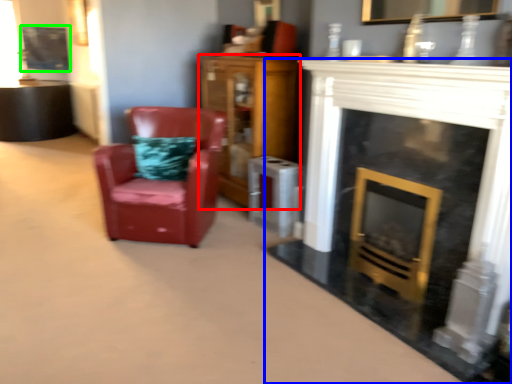
Question: Which is nearer to the cabinetry (highlighted by a red box)? fireplace (highlighted by a blue box) or picture frame (highlighted by a green box).

Choices:
 (A) fireplace
 (B) picture frame

Answer: (A)